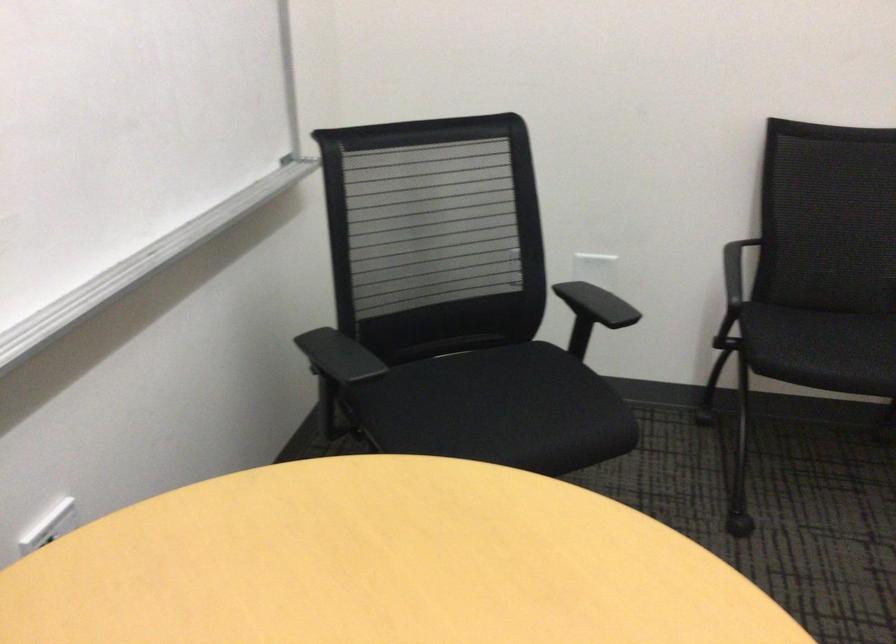
Find where to plugging in the white electrical outlet. Please return your answer as a coordinate pair (x, y).

(49, 526)